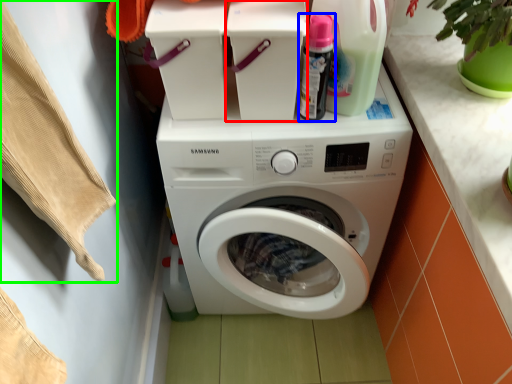
Question: Which is farther away from appliance (highlighted by a red box)? cleaning product (highlighted by a blue box) or clothing (highlighted by a green box)?

Choices:
 (A) cleaning product
 (B) clothing

Answer: (B)